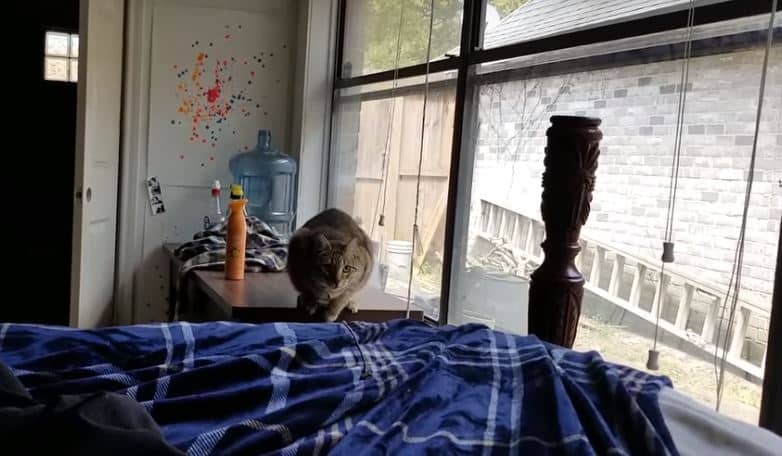
You are a GUI agent. You are given a task and a screenshot of the screen. Output one action in this format:
    pyautogui.click(x=<x>, y=<y>)
    Task: Click on the white bucket
    The height and width of the screenshot is (456, 782).
    Given the screenshot: What is the action you would take?
    pyautogui.click(x=397, y=256)